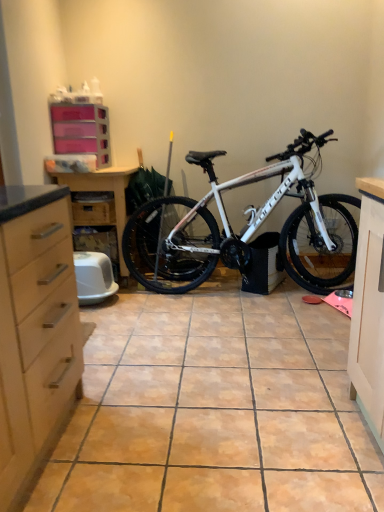
At what (x,y) coordinates should I click in order to perform the action: click on free space in front of white matte bicycle at center. Please return your answer as a coordinate pair (x, y). The height and width of the screenshot is (512, 384). Looking at the image, I should click on (238, 350).